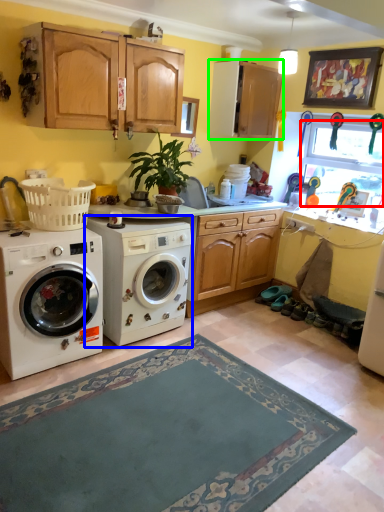
Question: Which is nearer to the window screen (highlighted by a red box)? washing machine (highlighted by a blue box) or cabinetry (highlighted by a green box).

Choices:
 (A) washing machine
 (B) cabinetry

Answer: (B)